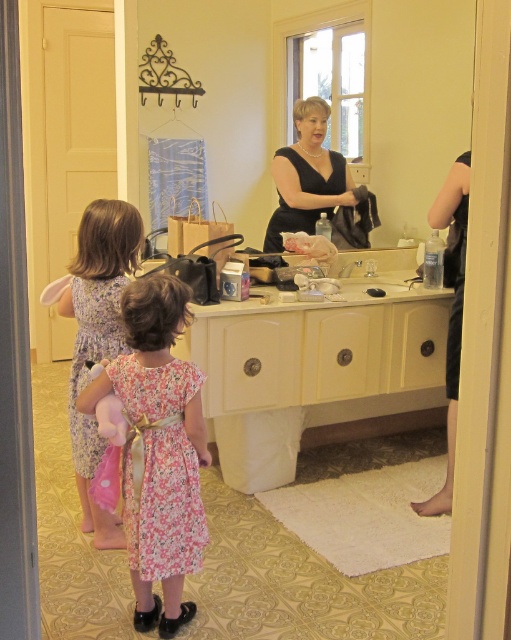
Question: Which point appears closest to the camera in this image?

Choices:
 (A) (419, 145)
 (B) (433, 348)
 (C) (184, 371)
 (D) (86, 339)

Answer: (C)

Question: From the image, what is the correct spatial relationship of cream matte vanity at center in relation to floral cotton dress at center?

Choices:
 (A) above
 (B) below

Answer: (A)

Question: Is floral fabric dress at center smaller than black satin dress at center?

Choices:
 (A) yes
 (B) no

Answer: (A)

Question: Which point is farther to the camera?

Choices:
 (A) (297, 136)
 (B) (88, 448)
 (C) (142, 573)
 (D) (216, 1)

Answer: (A)

Question: Which of the following is the closest to the observer?

Choices:
 (A) black matte dress at right
 (B) floral cotton dress at center
 (C) floral fabric dress at lower left
 (D) floral fabric dress at center

Answer: (B)

Question: Is black glossy mirror at upper center further to camera compared to black matte dress at right?

Choices:
 (A) no
 (B) yes

Answer: (B)